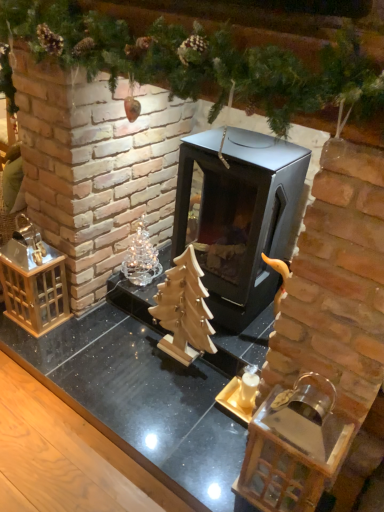
Question: Should I look upward or downward to see black metal fireplace at center?

Choices:
 (A) up
 (B) down

Answer: (A)

Question: From a real-world perspective, is clear glass ornament at center left beneath black metal fireplace at center?

Choices:
 (A) no
 (B) yes

Answer: (B)

Question: Does clear glass ornament at center left have a greater width compared to black metal fireplace at center?

Choices:
 (A) yes
 (B) no

Answer: (B)

Question: Is clear glass ornament at center left with black metal fireplace at center?

Choices:
 (A) no
 (B) yes

Answer: (A)

Question: Considering the relative positions of clear glass ornament at center left and black metal fireplace at center in the image provided, is clear glass ornament at center left to the left of black metal fireplace at center from the viewer's perspective?

Choices:
 (A) yes
 (B) no

Answer: (A)

Question: Is clear glass ornament at center left outside of black metal fireplace at center?

Choices:
 (A) no
 (B) yes

Answer: (B)

Question: Would you say clear glass ornament at center left contains black metal fireplace at center?

Choices:
 (A) yes
 (B) no

Answer: (B)

Question: Is black metal fireplace at center to the left of clear glass ornament at center left from the viewer's perspective?

Choices:
 (A) no
 (B) yes

Answer: (A)

Question: From the image's perspective, is black metal fireplace at center located beneath clear glass ornament at center left?

Choices:
 (A) no
 (B) yes

Answer: (A)

Question: From a real-world perspective, does black metal fireplace at center sit lower than clear glass ornament at center left?

Choices:
 (A) yes
 (B) no

Answer: (B)

Question: Is clear glass ornament at center left at the back of black metal fireplace at center?

Choices:
 (A) no
 (B) yes

Answer: (A)

Question: Are black metal fireplace at center and clear glass ornament at center left far apart?

Choices:
 (A) no
 (B) yes

Answer: (A)

Question: Is black metal fireplace at center positioned behind clear glass ornament at center left?

Choices:
 (A) yes
 (B) no

Answer: (B)

Question: Is clear glass ornament at center left inside wooden christmas tree at center?

Choices:
 (A) yes
 (B) no

Answer: (B)